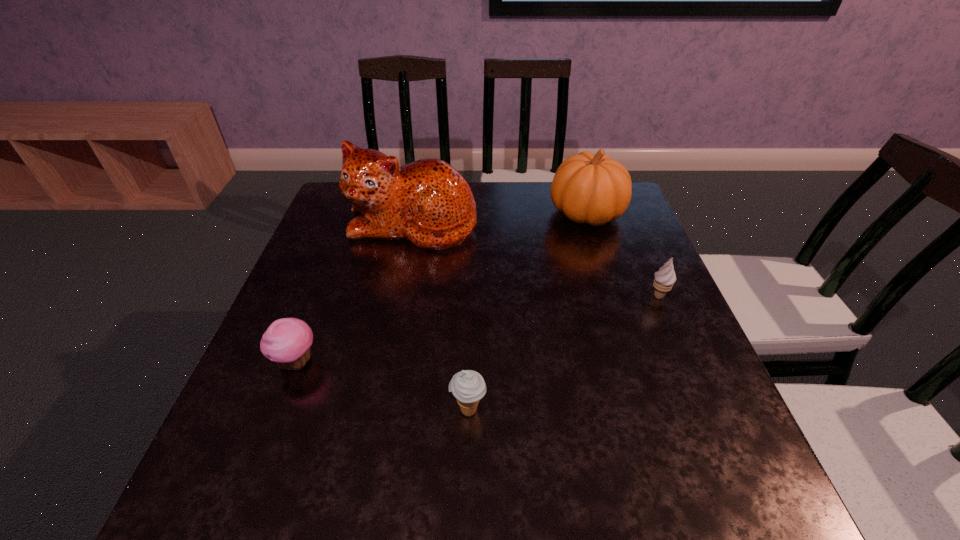
This screenshot has height=540, width=960. I want to click on empty space between the cupcake and the pumpkin, so click(x=442, y=288).

The height and width of the screenshot is (540, 960). What are the coordinates of `vacant area between the nearest object and the cupcake` in the screenshot? It's located at (382, 386).

Where is `empty space between the cat and the fourth farthest object`? empty space between the cat and the fourth farthest object is located at coordinates (355, 293).

Locate an element on the screen. object that stands as the fourth closest to the second nearest object is located at coordinates (664, 279).

Locate an element on the screen. The image size is (960, 540). object identified as the fourth closest to the cupcake is located at coordinates (664, 279).

At what (x,y) coordinates should I click in order to perform the action: click on vacant position in the image that satisfies the following two spatial constraints: 1. on the front side of the second nearest object; 2. on the left side of the nearer icecream. Please return your answer as a coordinate pair (x, y). The width and height of the screenshot is (960, 540). Looking at the image, I should click on (278, 410).

What are the coordinates of `vacant space that satisfies the following two spatial constraints: 1. on the back side of the nearest object; 2. on the right side of the second tallest object` in the screenshot? It's located at (472, 213).